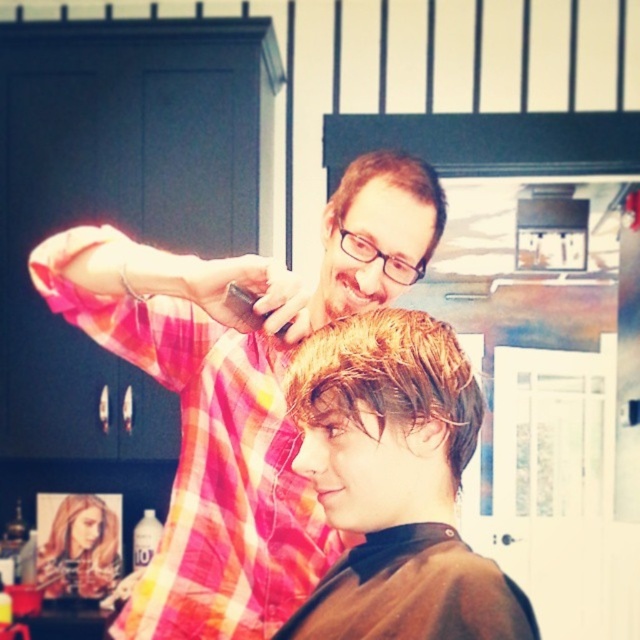
You are a customer in a barbershop and you see two hair strands, a shiny brown hair at center and a shiny blonde hair at center. Which one is located below the other?

The shiny brown hair at center is positioned under the shiny blonde hair at center.

You are a customer in a barbershop and want to know if you can comfortably reach the pink plaid shirt at upper left while sitting in the barber chair. The average arm length for an adult is 27 inches. Can you reach it?

The distance between you and the pink plaid shirt at upper left is 35.62 inches, which is greater than the average adult arm length of 27 inches. Therefore, you cannot comfortably reach it.